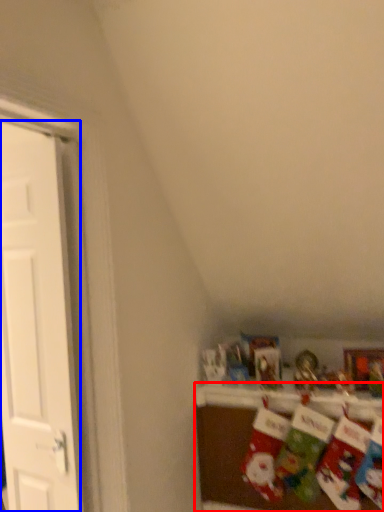
Question: Among these objects, which one is farthest to the camera, shelf (highlighted by a red box) or door (highlighted by a blue box)?

Choices:
 (A) shelf
 (B) door

Answer: (A)